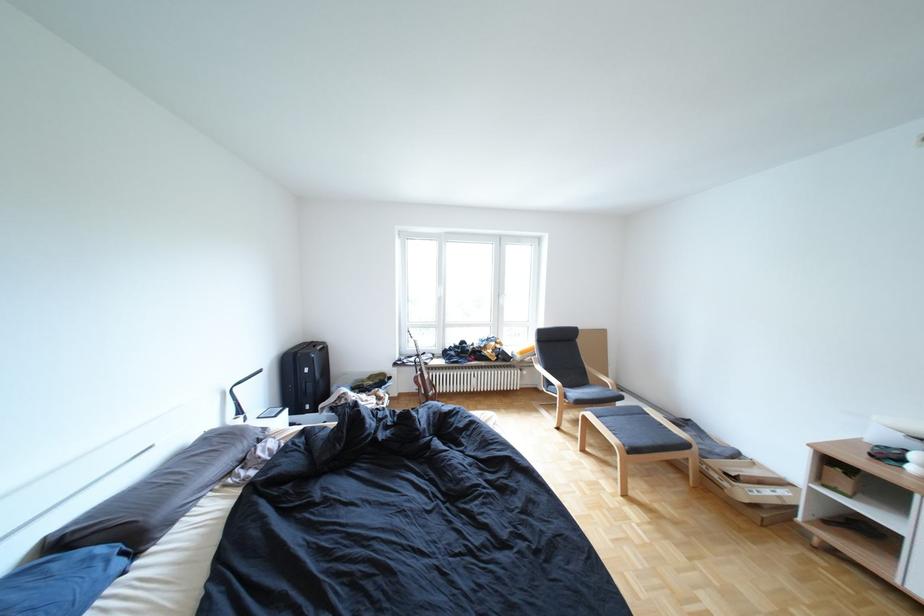
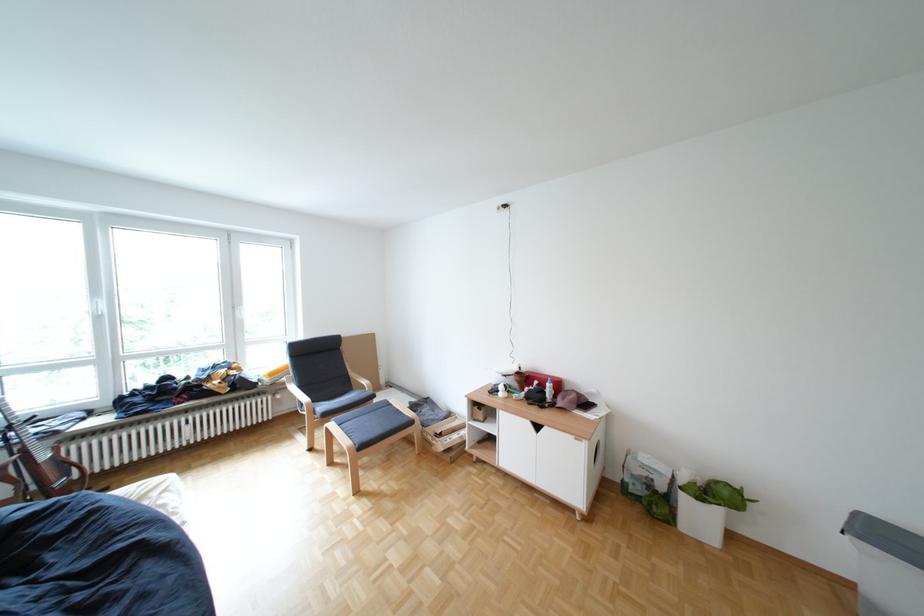
Find the pixel in the second image that matches pixel 750 479 in the first image.

(456, 436)